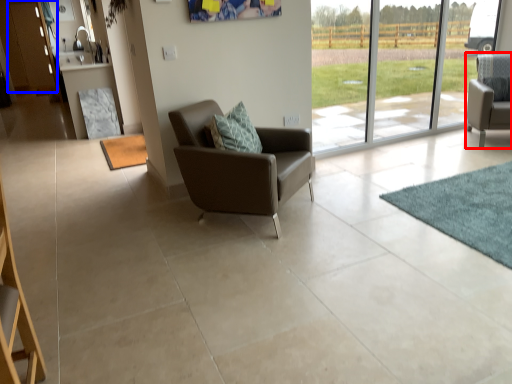
Question: Which point is further to the camera, chair (highlighted by a red box) or screen door (highlighted by a blue box)?

Choices:
 (A) chair
 (B) screen door

Answer: (B)